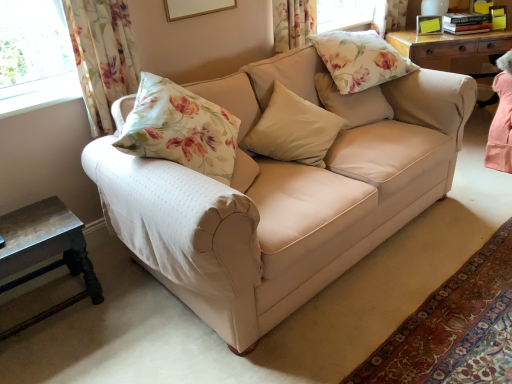
Identify the location of rustic wood side table at lower left. (45, 252).

Find the location of `beige fabric pillow at center, placed as the 3th pillow when sorted from top to bottom`. beige fabric pillow at center, placed as the 3th pillow when sorted from top to bottom is located at coordinates (293, 129).

Locate an element on the screen. floral fabric pillow at upper right, which is the second pillow in top-to-bottom order is located at coordinates (353, 102).

From a real-world perspective, is beige fabric couch at center positioned over floral fabric pillow at upper right, arranged as the 2th pillow when ordered from the bottom, based on gravity?

Actually, beige fabric couch at center is physically below floral fabric pillow at upper right, arranged as the 2th pillow when ordered from the bottom, in the real world.

In the scene shown: Based on their positions, is beige fabric couch at center located to the left or right of floral fabric pillow at upper right, which is the second pillow in top-to-bottom order?

Based on their positions, beige fabric couch at center is located to the left of floral fabric pillow at upper right, which is the second pillow in top-to-bottom order.

Considering the relative sizes of beige fabric couch at center and floral fabric pillow at upper right, arranged as the 2th pillow when ordered from the bottom, in the image provided, is beige fabric couch at center shorter than floral fabric pillow at upper right, arranged as the 2th pillow when ordered from the bottom,?

No.

From the picture: Considering the relative sizes of beige fabric couch at center and floral fabric pillow at upper right, arranged as the 2th pillow when ordered from the bottom, in the image provided, is beige fabric couch at center bigger than floral fabric pillow at upper right, arranged as the 2th pillow when ordered from the bottom,?

Correct, beige fabric couch at center is larger in size than floral fabric pillow at upper right, arranged as the 2th pillow when ordered from the bottom.

Relative to rustic wood side table at lower left, is beige fabric couch at center in front or behind?

beige fabric couch at center is in front of rustic wood side table at lower left.

Is beige fabric couch at center bigger or smaller than rustic wood side table at lower left?

Clearly, beige fabric couch at center is larger in size than rustic wood side table at lower left.

Considering the positions of objects beige fabric couch at center and rustic wood side table at lower left in the image provided, who is more to the left, beige fabric couch at center or rustic wood side table at lower left?

rustic wood side table at lower left is more to the left.

Is point (456, 84) more distant than point (36, 257)?

Yes, it is.

Which is more to the left, floral fabric pillow at upper right, which is the second pillow in top-to-bottom order, or beige fabric pillow at center, arranged as the first pillow when ordered from the bottom?

beige fabric pillow at center, arranged as the first pillow when ordered from the bottom, is more to the left.

From the picture: Is floral fabric pillow at upper right, arranged as the 2th pillow when ordered from the bottom, wider or thinner than beige fabric pillow at center, arranged as the first pillow when ordered from the bottom?

Clearly, floral fabric pillow at upper right, arranged as the 2th pillow when ordered from the bottom, has less width compared to beige fabric pillow at center, arranged as the first pillow when ordered from the bottom.

I want to click on pillow below the floral fabric pillow at upper right, which is the second pillow in top-to-bottom order (from a real-world perspective), so click(x=293, y=129).

Can you confirm if floral fabric pillow at upper right, which is the second pillow in top-to-bottom order, is taller than beige fabric pillow at center, placed as the 3th pillow when sorted from top to bottom?

Indeed, floral fabric pillow at upper right, which is the second pillow in top-to-bottom order, has a greater height compared to beige fabric pillow at center, placed as the 3th pillow when sorted from top to bottom.

In terms of size, does floral fabric pillow at upper center, placed as the third pillow when sorted from bottom to top, appear bigger or smaller than floral fabric curtain at upper left?

Clearly, floral fabric pillow at upper center, placed as the third pillow when sorted from bottom to top, is larger in size than floral fabric curtain at upper left.

Is floral fabric pillow at upper center, placed as the third pillow when sorted from bottom to top, further to camera compared to floral fabric curtain at upper left?

Yes, floral fabric pillow at upper center, placed as the third pillow when sorted from bottom to top, is further from the camera.

From a real-world perspective, is floral fabric pillow at upper center, placed as the third pillow when sorted from bottom to top, positioned over floral fabric curtain at upper left based on gravity?

No, from a real-world perspective, floral fabric pillow at upper center, placed as the third pillow when sorted from bottom to top, is not above floral fabric curtain at upper left.

Is floral fabric pillow at upper center, the first pillow viewed from the top, positioned far away from floral fabric curtain at upper left?

Yes, floral fabric pillow at upper center, the first pillow viewed from the top, and floral fabric curtain at upper left are quite far apart.

From a real-world perspective, is beige fabric couch at center physically above floral fabric pillow at upper center, placed as the third pillow when sorted from bottom to top?

Incorrect, from a real-world perspective, beige fabric couch at center is lower than floral fabric pillow at upper center, placed as the third pillow when sorted from bottom to top.

Is beige fabric couch at center far from floral fabric pillow at upper center, placed as the third pillow when sorted from bottom to top?

Actually, beige fabric couch at center and floral fabric pillow at upper center, placed as the third pillow when sorted from bottom to top, are a little close together.

Is beige fabric couch at center facing towards floral fabric pillow at upper center, the first pillow viewed from the top?

No, beige fabric couch at center is not aimed at floral fabric pillow at upper center, the first pillow viewed from the top.

Is beige fabric couch at center further to the viewer compared to floral fabric pillow at upper center, placed as the third pillow when sorted from bottom to top?

No, it is in front of floral fabric pillow at upper center, placed as the third pillow when sorted from bottom to top.

Which is less distant, (x=279, y=139) or (x=362, y=106)?

Point (x=279, y=139).

From a real-world perspective, is beige fabric pillow at center, placed as the 3th pillow when sorted from top to bottom, physically above floral fabric pillow at upper right, which is the second pillow in top-to-bottom order?

No, from a real-world perspective, beige fabric pillow at center, placed as the 3th pillow when sorted from top to bottom, is not on top of floral fabric pillow at upper right, which is the second pillow in top-to-bottom order.

From the image's perspective, which is below, beige fabric pillow at center, arranged as the first pillow when ordered from the bottom, or floral fabric pillow at upper right, which is the second pillow in top-to-bottom order?

beige fabric pillow at center, arranged as the first pillow when ordered from the bottom, appears lower in the image.

Can you confirm if beige fabric pillow at center, arranged as the first pillow when ordered from the bottom, is wider than floral fabric pillow at upper right, which is the second pillow in top-to-bottom order?

Indeed, beige fabric pillow at center, arranged as the first pillow when ordered from the bottom, has a greater width compared to floral fabric pillow at upper right, which is the second pillow in top-to-bottom order.

Considering the sizes of floral fabric curtain at upper left and beige fabric pillow at center, arranged as the first pillow when ordered from the bottom, in the image, is floral fabric curtain at upper left taller or shorter than beige fabric pillow at center, arranged as the first pillow when ordered from the bottom,?

Clearly, floral fabric curtain at upper left is taller compared to beige fabric pillow at center, arranged as the first pillow when ordered from the bottom.

What's the angular difference between floral fabric curtain at upper left and beige fabric pillow at center, placed as the 3th pillow when sorted from top to bottom,'s facing directions?

31.6 degrees.

Is floral fabric curtain at upper left touching beige fabric pillow at center, arranged as the first pillow when ordered from the bottom?

No, floral fabric curtain at upper left is not touching beige fabric pillow at center, arranged as the first pillow when ordered from the bottom.

Locate an element on the screen. Image resolution: width=512 pixels, height=384 pixels. pillow that is the 3rd one below the floral fabric curtain at upper left (from a real-world perspective) is located at coordinates (293, 129).

Locate an element on the screen. Image resolution: width=512 pixels, height=384 pixels. studio couch located below the floral fabric pillow at upper right, which is the second pillow in top-to-bottom order (from the image's perspective) is located at coordinates (297, 206).

Identify the location of studio couch above the rustic wood side table at lower left (from a real-world perspective). The height and width of the screenshot is (384, 512). click(x=297, y=206).

From the image, which object appears to be nearer to rustic wood side table at lower left, beige fabric pillow at center, arranged as the first pillow when ordered from the bottom, or floral fabric pillow at upper right, which is the second pillow in top-to-bottom order?

Based on the image, beige fabric pillow at center, arranged as the first pillow when ordered from the bottom, appears to be nearer to rustic wood side table at lower left.

Which object lies nearer to the anchor point floral fabric curtain at upper left, beige fabric pillow at center, arranged as the first pillow when ordered from the bottom, or rustic wood side table at lower left?

The object closer to floral fabric curtain at upper left is rustic wood side table at lower left.

When comparing their distances from floral fabric pillow at upper right, which is the second pillow in top-to-bottom order, does floral fabric pillow at upper center, the first pillow viewed from the top, or beige fabric pillow at center, arranged as the first pillow when ordered from the bottom, seem closer?

floral fabric pillow at upper center, the first pillow viewed from the top, is closer to floral fabric pillow at upper right, which is the second pillow in top-to-bottom order.

When comparing their distances from floral fabric pillow at upper center, placed as the third pillow when sorted from bottom to top, does rustic wood side table at lower left or floral fabric curtain at upper left seem closer?

floral fabric curtain at upper left is closer to floral fabric pillow at upper center, placed as the third pillow when sorted from bottom to top.

From the image, which object appears to be farther from beige fabric pillow at center, arranged as the first pillow when ordered from the bottom, beige fabric couch at center or floral fabric pillow at upper center, the first pillow viewed from the top?

The object further to beige fabric pillow at center, arranged as the first pillow when ordered from the bottom, is floral fabric pillow at upper center, the first pillow viewed from the top.

When comparing their distances from beige fabric pillow at center, placed as the 3th pillow when sorted from top to bottom, does floral fabric pillow at upper center, the first pillow viewed from the top, or beige fabric couch at center seem further?

floral fabric pillow at upper center, the first pillow viewed from the top, is further to beige fabric pillow at center, placed as the 3th pillow when sorted from top to bottom.

Looking at the image, which one is located closer to floral fabric pillow at upper right, which is the second pillow in top-to-bottom order, floral fabric pillow at upper center, the first pillow viewed from the top, or beige fabric couch at center?

Based on the image, floral fabric pillow at upper center, the first pillow viewed from the top, appears to be nearer to floral fabric pillow at upper right, which is the second pillow in top-to-bottom order.

Which object lies further to the anchor point beige fabric couch at center, floral fabric pillow at upper center, placed as the third pillow when sorted from bottom to top, or beige fabric pillow at center, placed as the 3th pillow when sorted from top to bottom?

Based on the image, floral fabric pillow at upper center, placed as the third pillow when sorted from bottom to top, appears to be further to beige fabric couch at center.

Image resolution: width=512 pixels, height=384 pixels. I want to click on pillow between beige fabric pillow at center, arranged as the first pillow when ordered from the bottom, and floral fabric pillow at upper center, the first pillow viewed from the top, so click(353, 102).

At what (x,y) coordinates should I click in order to perform the action: click on curtain between rustic wood side table at lower left and beige fabric pillow at center, placed as the 3th pillow when sorted from top to bottom, from left to right. Please return your answer as a coordinate pair (x, y). Image resolution: width=512 pixels, height=384 pixels. Looking at the image, I should click on (102, 56).

Find the location of `pillow between rustic wood side table at lower left and beige fabric couch at center in the horizontal direction`. pillow between rustic wood side table at lower left and beige fabric couch at center in the horizontal direction is located at coordinates (293, 129).

Image resolution: width=512 pixels, height=384 pixels. Identify the location of pillow between rustic wood side table at lower left and floral fabric pillow at upper right, which is the second pillow in top-to-bottom order. (293, 129).